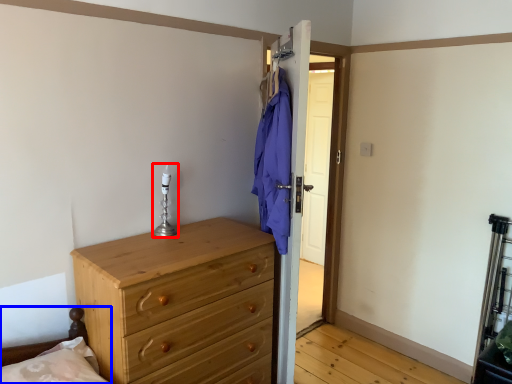
Question: Which of the following is the closest to the observer, candle holder (highlighted by a red box) or bed frame (highlighted by a blue box)?

Choices:
 (A) candle holder
 (B) bed frame

Answer: (B)